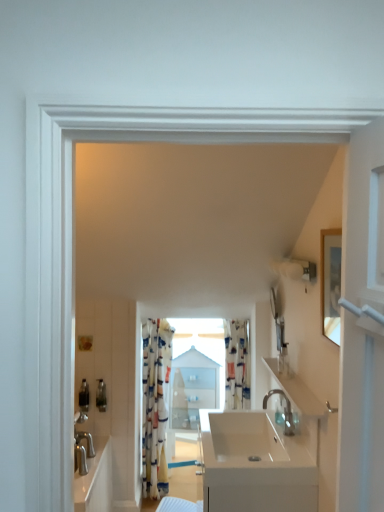
Identify the location of white glossy sink at center. This screenshot has width=384, height=512. (256, 464).

At what (x,y) coordinates should I click in order to perform the action: click on printed fabric curtain at center, placed as the 2th curtain when sorted from left to right. Please return your answer as a coordinate pair (x, y). Looking at the image, I should click on (236, 364).

Measure the distance between satin nickel faucet at sink right and camera.

1.95 meters.

Image resolution: width=384 pixels, height=512 pixels. I want to click on matte plastic soap dispenser at upper right, the second toiletry when ordered from bottom to top, so click(x=283, y=359).

From a real-world perspective, is metallic silver toiletry at lower left, the first toiletry viewed from the back, under patterned fabric curtain at center, which ranks as the first curtain in left-to-right order?

No, from a real-world perspective, metallic silver toiletry at lower left, the first toiletry viewed from the back, is not beneath patterned fabric curtain at center, which ranks as the first curtain in left-to-right order.

From the image's perspective, is metallic silver toiletry at lower left, which is the second toiletry from top to bottom, positioned above or below patterned fabric curtain at center, placed as the 2th curtain when sorted from right to left?

metallic silver toiletry at lower left, which is the second toiletry from top to bottom, is situated higher than patterned fabric curtain at center, placed as the 2th curtain when sorted from right to left, in the image.

Is metallic silver toiletry at lower left, arranged as the 1th toiletry when viewed from the left, not inside patterned fabric curtain at center, placed as the 2th curtain when sorted from right to left?

Yes, metallic silver toiletry at lower left, arranged as the 1th toiletry when viewed from the left, is located beyond the bounds of patterned fabric curtain at center, placed as the 2th curtain when sorted from right to left.

Considering the sizes of metallic silver toiletry at lower left, arranged as the 1th toiletry when viewed from the left, and patterned fabric curtain at center, placed as the 2th curtain when sorted from right to left, in the image, is metallic silver toiletry at lower left, arranged as the 1th toiletry when viewed from the left, wider or thinner than patterned fabric curtain at center, placed as the 2th curtain when sorted from right to left,?

In the image, metallic silver toiletry at lower left, arranged as the 1th toiletry when viewed from the left, appears to be more narrow than patterned fabric curtain at center, placed as the 2th curtain when sorted from right to left.

Is transparent glass window at center touching glossy white mirror at upper right?

No, transparent glass window at center is not making contact with glossy white mirror at upper right.

Is transparent glass window at center looking in the opposite direction of glossy white mirror at upper right?

No.

Considering the sizes of objects transparent glass window at center and glossy white mirror at upper right in the image provided, who is bigger, transparent glass window at center or glossy white mirror at upper right?

Bigger between the two is transparent glass window at center.

Between transparent glass window at center and glossy white mirror at upper right, which one is positioned behind?

transparent glass window at center.

Is there a large distance between metallic silver toiletry at lower left, arranged as the 1th toiletry when viewed from the left, and satin nickel faucet at sink right?

Yes, metallic silver toiletry at lower left, arranged as the 1th toiletry when viewed from the left, and satin nickel faucet at sink right are quite far apart.

How many degrees apart are the facing directions of metallic silver toiletry at lower left, the 2th toiletry viewed from the right, and satin nickel faucet at sink right?

The angle between the facing direction of metallic silver toiletry at lower left, the 2th toiletry viewed from the right, and the facing direction of satin nickel faucet at sink right is 88.6 degrees.

Which object is positioned more to the right, metallic silver toiletry at lower left, which is counted as the second toiletry, starting from the front, or satin nickel faucet at sink right?

satin nickel faucet at sink right.

Is point (101, 403) closer or farther from the camera than point (285, 396)?

Point (101, 403) is positioned farther from the camera compared to point (285, 396).

Can you confirm if transparent glass window at center is wider than satin nickel faucet at sink right?

Yes, transparent glass window at center is wider than satin nickel faucet at sink right.

Consider the image. From the image's perspective, is transparent glass window at center located above satin nickel faucet at sink right?

Incorrect, from the image's perspective, transparent glass window at center is lower than satin nickel faucet at sink right.

Based on their positions, is transparent glass window at center located to the left or right of satin nickel faucet at sink right?

In the image, transparent glass window at center appears on the left side of satin nickel faucet at sink right.

Which is behind, transparent glass window at center or satin nickel faucet at sink right?

transparent glass window at center is more distant.

Considering the sizes of transparent glass window at center and metallic silver toiletry at lower left, the 2th toiletry viewed from the right, in the image, is transparent glass window at center taller or shorter than metallic silver toiletry at lower left, the 2th toiletry viewed from the right,?

In the image, transparent glass window at center appears to be taller than metallic silver toiletry at lower left, the 2th toiletry viewed from the right.

From a real-world perspective, is transparent glass window at center above or below metallic silver toiletry at lower left, which is the second toiletry from top to bottom?

Clearly, from a real-world perspective, transparent glass window at center is below metallic silver toiletry at lower left, which is the second toiletry from top to bottom.

Does transparent glass window at center turn towards metallic silver toiletry at lower left, the first toiletry viewed from the back?

No, transparent glass window at center is not oriented towards metallic silver toiletry at lower left, the first toiletry viewed from the back.

Considering the points (175, 381) and (104, 402), which point is in front, point (175, 381) or point (104, 402)?

Positioned in front is point (104, 402).

Which object is closer to the camera taking this photo, matte plastic soap dispenser at upper right, marked as the second toiletry in a left-to-right arrangement, or patterned fabric curtain at center, placed as the 2th curtain when sorted from right to left?

matte plastic soap dispenser at upper right, marked as the second toiletry in a left-to-right arrangement, is closer to the camera.

From the image's perspective, would you say matte plastic soap dispenser at upper right, the 1th toiletry in the right-to-left sequence, is shown under patterned fabric curtain at center, placed as the 2th curtain when sorted from right to left?

No.

Consider the image. Could you measure the distance between matte plastic soap dispenser at upper right, acting as the first toiletry starting from the front, and patterned fabric curtain at center, placed as the 2th curtain when sorted from right to left?

1.13 meters.

In the scene shown: Considering the sizes of objects matte plastic soap dispenser at upper right, the second toiletry in the back-to-front sequence, and patterned fabric curtain at center, placed as the 2th curtain when sorted from right to left, in the image provided, who is thinner, matte plastic soap dispenser at upper right, the second toiletry in the back-to-front sequence, or patterned fabric curtain at center, placed as the 2th curtain when sorted from right to left,?

matte plastic soap dispenser at upper right, the second toiletry in the back-to-front sequence.

Which is in front, white glossy sink at center or printed fabric curtain at center, which ranks as the first curtain in right-to-left order?

white glossy sink at center is more forward.

Which point is more distant from viewer, (298,451) or (226,339)?

Positioned behind is point (226,339).

Consider the image. Is printed fabric curtain at center, which ranks as the first curtain in right-to-left order, at the back of white glossy sink at center?

No.

Considering the relative sizes of white glossy sink at center and printed fabric curtain at center, which ranks as the first curtain in right-to-left order, in the image provided, is white glossy sink at center taller than printed fabric curtain at center, which ranks as the first curtain in right-to-left order,?

In fact, white glossy sink at center may be shorter than printed fabric curtain at center, which ranks as the first curtain in right-to-left order.

Locate an element on the screen. Image resolution: width=384 pixels, height=512 pixels. the 1st toiletry positioned above the patterned fabric curtain at center, placed as the 2th curtain when sorted from right to left (from a real-world perspective) is located at coordinates (101, 396).

You are a GUI agent. You are given a task and a screenshot of the screen. Output one action in this format:
    pyautogui.click(x=<x>, y=<y>)
    Task: Click on the window lying below the glossy white mirror at upper right (from the image's perspective)
    
    Given the screenshot: What is the action you would take?
    pyautogui.click(x=194, y=377)

Which object lies further to the anchor point printed fabric curtain at center, placed as the 2th curtain when sorted from left to right, glossy white mirror at upper right or metallic silver toiletry at lower left, the first toiletry viewed from the back?

metallic silver toiletry at lower left, the first toiletry viewed from the back, is positioned further to the anchor printed fabric curtain at center, placed as the 2th curtain when sorted from left to right.

Which object lies nearer to the anchor point printed fabric curtain at center, placed as the 2th curtain when sorted from left to right, white glossy sink at center or satin nickel faucet at sink right?

satin nickel faucet at sink right.

Estimate the real-world distances between objects in this image. Which object is closer to transparent glass window at center, glossy white mirror at upper right or patterned fabric curtain at center, placed as the 2th curtain when sorted from right to left?

The object closer to transparent glass window at center is patterned fabric curtain at center, placed as the 2th curtain when sorted from right to left.

Looking at the image, which one is located further to transparent glass window at center, satin nickel faucet at sink right or patterned fabric curtain at center, which ranks as the first curtain in left-to-right order?

Based on the image, satin nickel faucet at sink right appears to be further to transparent glass window at center.

Looking at this image, looking at the image, which one is located further to white glossy sink at center, printed fabric curtain at center, placed as the 2th curtain when sorted from left to right, or glossy white mirror at upper right?

printed fabric curtain at center, placed as the 2th curtain when sorted from left to right.

When comparing their distances from metallic silver toiletry at lower left, the first toiletry viewed from the back, does patterned fabric curtain at center, placed as the 2th curtain when sorted from right to left, or glossy white mirror at upper right seem further?

glossy white mirror at upper right lies further to metallic silver toiletry at lower left, the first toiletry viewed from the back, than the other object.

Based on their spatial positions, is glossy white mirror at upper right or satin nickel faucet at sink right closer to patterned fabric curtain at center, which ranks as the first curtain in left-to-right order?

satin nickel faucet at sink right is positioned closer to the anchor patterned fabric curtain at center, which ranks as the first curtain in left-to-right order.

Looking at the image, which one is located closer to satin nickel faucet at sink right, matte plastic soap dispenser at upper right, the 1th toiletry in the right-to-left sequence, or glossy white mirror at upper right?

The object closer to satin nickel faucet at sink right is matte plastic soap dispenser at upper right, the 1th toiletry in the right-to-left sequence.

Locate an element on the screen. mirror between matte plastic soap dispenser at upper right, the second toiletry in the back-to-front sequence, and printed fabric curtain at center, which ranks as the first curtain in right-to-left order, from front to back is located at coordinates (277, 320).

Locate an element on the screen. This screenshot has width=384, height=512. mirror positioned between satin nickel faucet at sink right and transparent glass window at center from near to far is located at coordinates (277, 320).

This screenshot has height=512, width=384. Identify the location of sink located between metallic silver toiletry at lower left, the first toiletry viewed from the back, and satin nickel faucet at sink right in the left-right direction. (256, 464).

Find the location of a particular element. tap located between metallic silver toiletry at lower left, the first toiletry viewed from the back, and matte plastic soap dispenser at upper right, the second toiletry when ordered from bottom to top, in the left-right direction is located at coordinates (284, 412).